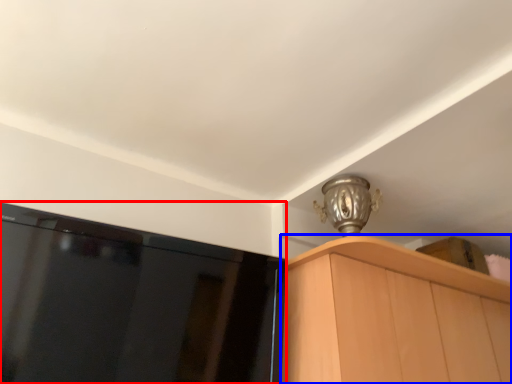
Question: Which object is closer to the camera taking this photo, screen (highlighted by a red box) or cabinetry (highlighted by a blue box)?

Choices:
 (A) screen
 (B) cabinetry

Answer: (A)